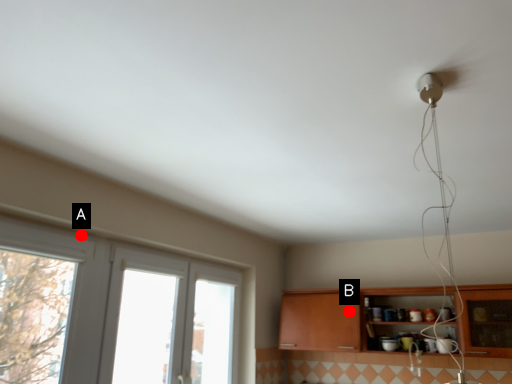
Question: Two points are circled on the image, labeled by A and B beside each circle. Which point is farther from the camera taking this photo?

Choices:
 (A) A is further
 (B) B is further

Answer: (B)